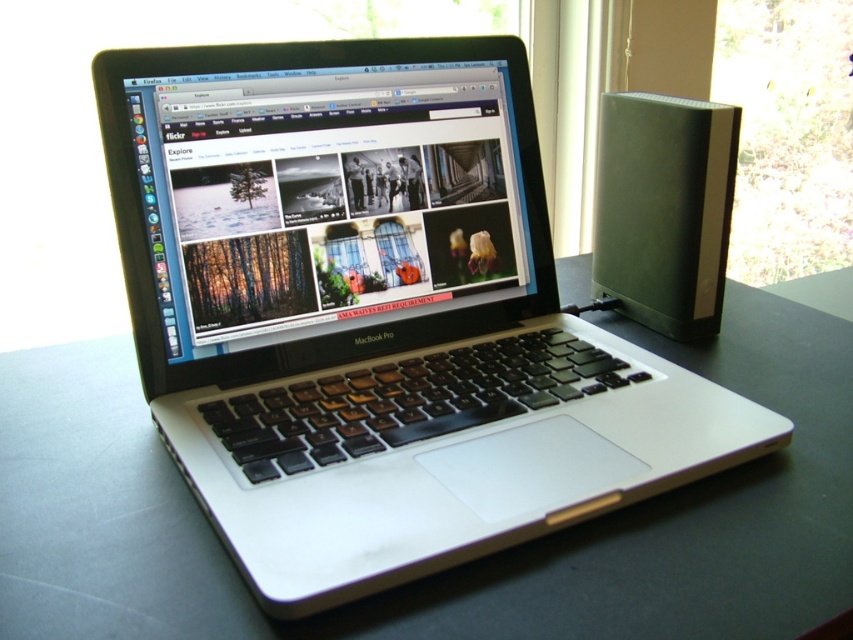
You are sitting at a desk and want to click on the transparent glass window at upper right. Which direction should you move your mouse cursor from the satin black laptop at center to reach it?

The satin black laptop at center is to the left of the transparent glass window at upper right, so you should move your mouse cursor to the right to reach the transparent glass window at upper right.